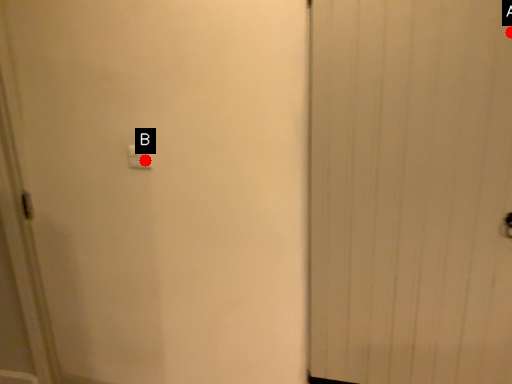
Question: Two points are circled on the image, labeled by A and B beside each circle. Which of the following is the farthest from the observer?

Choices:
 (A) A is further
 (B) B is further

Answer: (B)